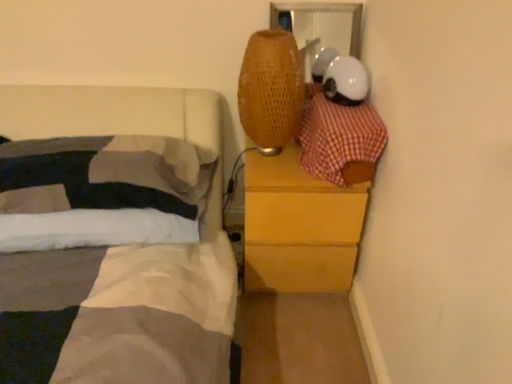
This screenshot has height=384, width=512. Describe the element at coordinates (340, 139) in the screenshot. I see `red checkered fabric at upper right` at that location.

The width and height of the screenshot is (512, 384). What are the coordinates of `red checkered fabric at upper right` in the screenshot? It's located at 340,139.

From a real-world perspective, between wooden chest of drawers at right and red checkered fabric at upper right, who is vertically lower?

wooden chest of drawers at right, from a real-world perspective.

Between wooden chest of drawers at right and red checkered fabric at upper right, which one is positioned in front?

red checkered fabric at upper right.

Would you say wooden chest of drawers at right is inside or outside red checkered fabric at upper right?

wooden chest of drawers at right is outside red checkered fabric at upper right.

Looking at this image, who is shorter, wooden chest of drawers at right or red checkered fabric at upper right?

red checkered fabric at upper right is shorter.

Can you confirm if white soft pillow at left is thinner than wooden chest of drawers at right?

Yes, white soft pillow at left is thinner than wooden chest of drawers at right.

Is the depth of white soft pillow at left greater than that of wooden chest of drawers at right?

No, it is not.

Considering the sizes of objects white soft pillow at left and wooden chest of drawers at right in the image provided, who is shorter, white soft pillow at left or wooden chest of drawers at right?

With less height is white soft pillow at left.

Is white soft pillow at left closer to camera compared to red checkered fabric at upper right?

No, white soft pillow at left is further to the viewer.

Is white soft pillow at left shorter than red checkered fabric at upper right?

Correct, white soft pillow at left is not as tall as red checkered fabric at upper right.

Can you see white soft pillow at left touching red checkered fabric at upper right?

No, white soft pillow at left is not touching red checkered fabric at upper right.

Does white soft pillow at left contain red checkered fabric at upper right?

No, red checkered fabric at upper right is not a part of white soft pillow at left.

From the image's perspective, is red checkered fabric at upper right on top of wooden chest of drawers at right?

Yes.

Locate an element on the screen. The width and height of the screenshot is (512, 384). the chest of drawers located behind the red checkered fabric at upper right is located at coordinates (298, 226).

Is red checkered fabric at upper right looking in the opposite direction of wooden chest of drawers at right?

No, wooden chest of drawers at right is not at the back of red checkered fabric at upper right.

Does point (383, 135) appear closer or farther from the camera than point (330, 281)?

Point (383, 135) is positioned closer to the camera compared to point (330, 281).

Between wooden chest of drawers at right and white soft pillow at left, which one has more height?

Standing taller between the two is wooden chest of drawers at right.

Is wooden chest of drawers at right facing towards white soft pillow at left?

No, wooden chest of drawers at right is not facing towards white soft pillow at left.

Is wooden chest of drawers at right to the left or to the right of white soft pillow at left in the image?

In the image, wooden chest of drawers at right appears on the right side of white soft pillow at left.

Which of these two, red checkered fabric at upper right or white soft pillow at left, is thinner?

With smaller width is white soft pillow at left.

From the image's perspective, relative to white soft pillow at left, is red checkered fabric at upper right above or below?

Clearly, from the image's perspective, red checkered fabric at upper right is above white soft pillow at left.

Could you tell me if red checkered fabric at upper right is turned towards white soft pillow at left?

No, red checkered fabric at upper right is not turned towards white soft pillow at left.

In terms of size, does red checkered fabric at upper right appear bigger or smaller than white soft pillow at left?

Considering their sizes, red checkered fabric at upper right takes up less space than white soft pillow at left.

Locate an element on the screen. This screenshot has height=384, width=512. chest of drawers that appears on the left of red checkered fabric at upper right is located at coordinates (298, 226).

What are the coordinates of `chest of drawers behind the white soft pillow at left` in the screenshot? It's located at (298, 226).

From the image, which object appears to be farther from white soft pillow at left, wooden chest of drawers at right or red checkered fabric at upper right?

Based on the image, red checkered fabric at upper right appears to be further to white soft pillow at left.

Which object lies nearer to the anchor point white soft pillow at left, red checkered fabric at upper right or wooden chest of drawers at right?

The object closer to white soft pillow at left is wooden chest of drawers at right.

Based on the photo, which object lies further to the anchor point wooden chest of drawers at right, white soft pillow at left or red checkered fabric at upper right?

white soft pillow at left lies further to wooden chest of drawers at right than the other object.

From the image, which object appears to be nearer to wooden chest of drawers at right, red checkered fabric at upper right or white soft pillow at left?

red checkered fabric at upper right lies closer to wooden chest of drawers at right than the other object.

Considering their positions, is wooden chest of drawers at right positioned closer to red checkered fabric at upper right than white soft pillow at left?

wooden chest of drawers at right is closer to red checkered fabric at upper right.

Looking at the image, which one is located closer to red checkered fabric at upper right, white soft pillow at left or wooden chest of drawers at right?

The object closer to red checkered fabric at upper right is wooden chest of drawers at right.

The width and height of the screenshot is (512, 384). Identify the location of chest of drawers between white soft pillow at left and red checkered fabric at upper right from left to right. (298, 226).